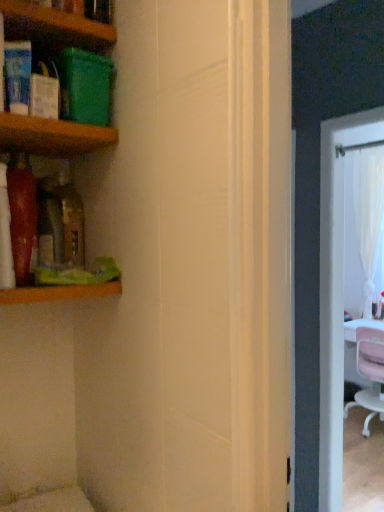
Question: From a real-world perspective, is pink fabric chair at right positioned above or below wooden shelf at left, the 1th shelf in the bottom-to-top sequence?

Choices:
 (A) above
 (B) below

Answer: (B)

Question: Would you say pink fabric chair at right is to the left or to the right of wooden shelf at left, the 1th shelf in the bottom-to-top sequence, in the picture?

Choices:
 (A) left
 (B) right

Answer: (B)

Question: Estimate the real-world distances between objects in this image. Which object is closer to the wooden shelf at upper left, the 1th shelf positioned from the top?

Choices:
 (A) wooden shelf at upper left, the 2th shelf viewed from the top
 (B) wooden shelf at left, the third shelf from the top
 (C) pink fabric chair at right

Answer: (A)

Question: Which of these objects is positioned closest to the wooden shelf at upper left, arranged as the 2th shelf when ordered from the bottom?

Choices:
 (A) wooden shelf at left, the 1th shelf in the bottom-to-top sequence
 (B) wooden shelf at upper left, which appears as the third shelf when ordered from the bottom
 (C) pink fabric chair at right

Answer: (B)